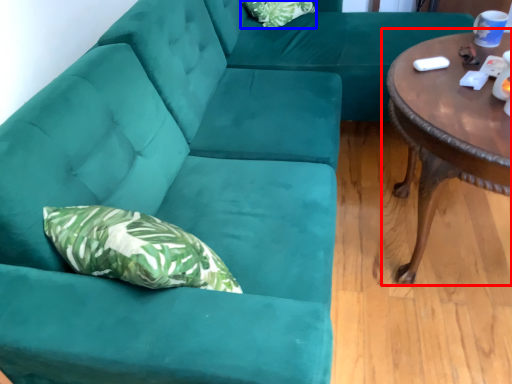
Question: Which of the following is the closest to the observer, coffee table (highlighted by a red box) or pillow (highlighted by a blue box)?

Choices:
 (A) coffee table
 (B) pillow

Answer: (A)